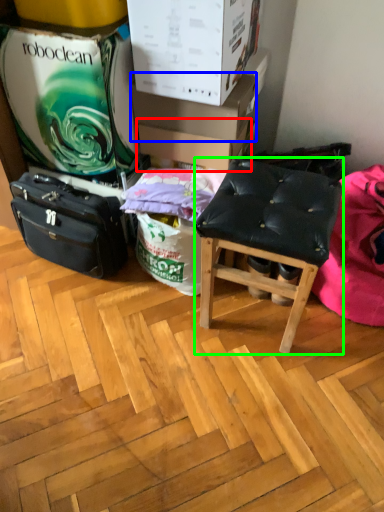
Question: Which object is the farthest from cardboard box (highlighted by a red box)? Choose among these: cardboard box (highlighted by a blue box) or stool (highlighted by a green box).

Choices:
 (A) cardboard box
 (B) stool

Answer: (B)